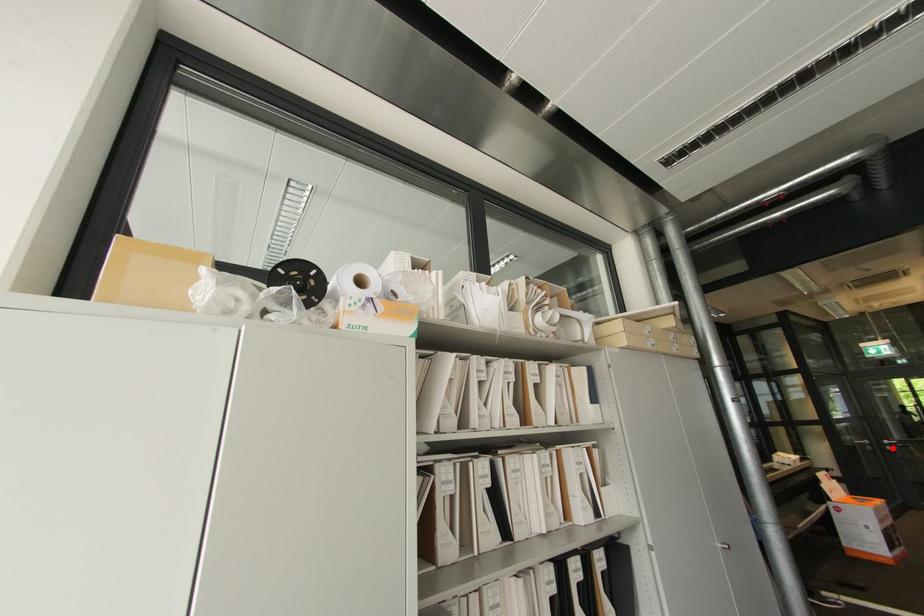
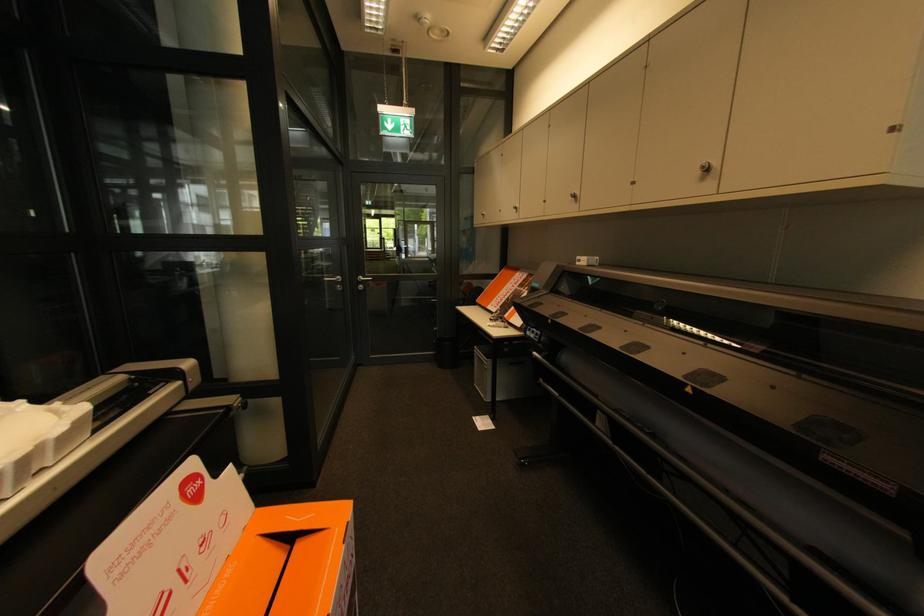
Question: I am providing you with two images of the same scene from different viewpoints. A red point is marked on the first image. At the location where the point appears in image 1, is it still visible in image 2?

Choices:
 (A) Yes
 (B) No

Answer: (A)